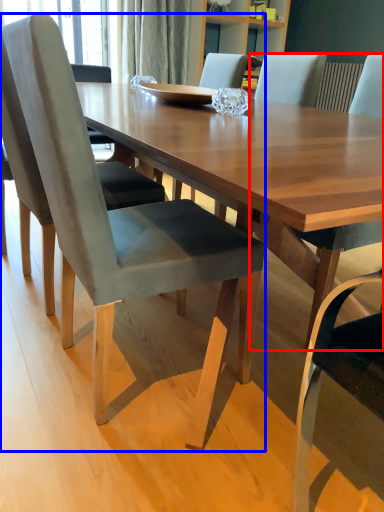
Question: Which of the following is the closest to the observer, chair (highlighted by a red box) or chair (highlighted by a blue box)?

Choices:
 (A) chair
 (B) chair

Answer: (B)